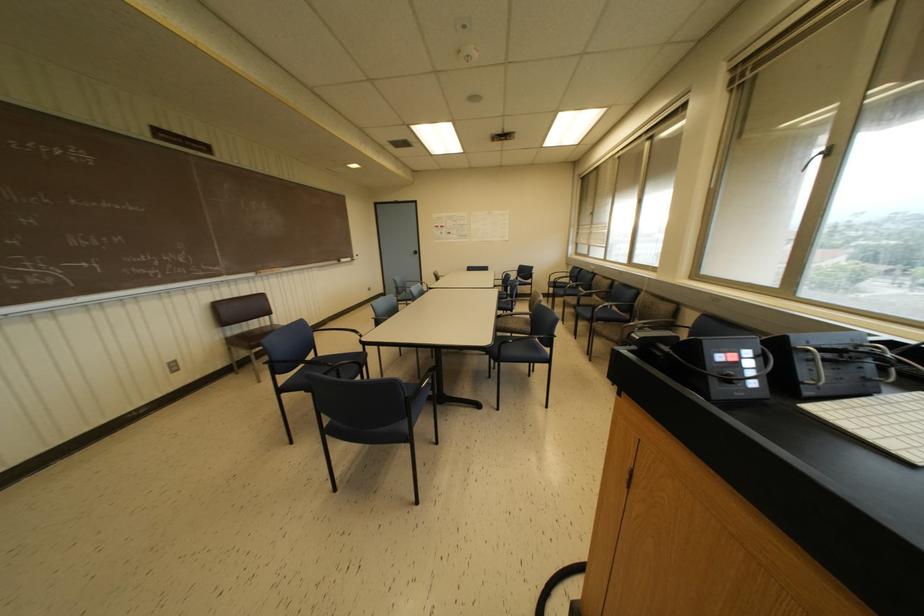
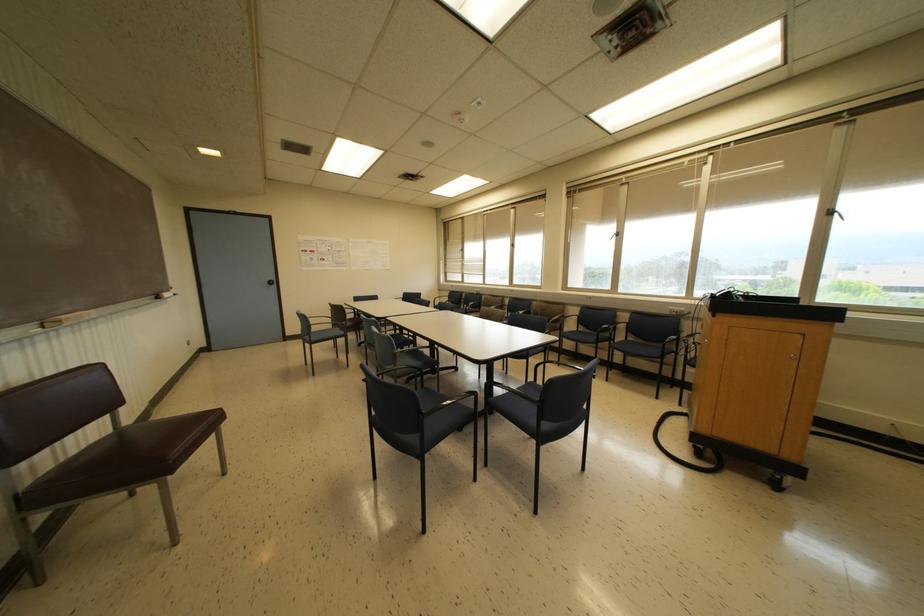
Question: I am providing you with two images of the same scene from different viewpoints. Please identify which objects are invisible in image2.

Choices:
 (A) black stamp object
 (B) white control knob
 (C) black door knob
 (D) chalkboard eraser

Answer: (B)